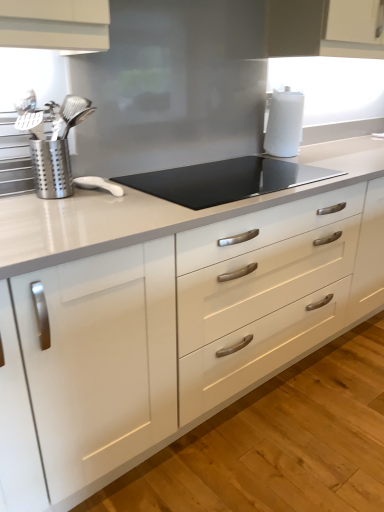
Question: From the image's perspective, relative to silver metallic utensil holder at left, is white glossy countertop at center above or below?

Choices:
 (A) above
 (B) below

Answer: (B)

Question: Is white glossy countertop at center bigger or smaller than silver metallic utensil holder at left?

Choices:
 (A) big
 (B) small

Answer: (A)

Question: Which is nearer to the silver metallic utensil holder at left?

Choices:
 (A) white matte paper towel at upper right
 (B) black glass cooktop at center
 (C) white glossy countertop at center

Answer: (B)

Question: Estimate the real-world distances between objects in this image. Which object is farther from the black glass cooktop at center?

Choices:
 (A) white glossy countertop at center
 (B) white matte paper towel at upper right
 (C) silver metallic utensil holder at left

Answer: (A)